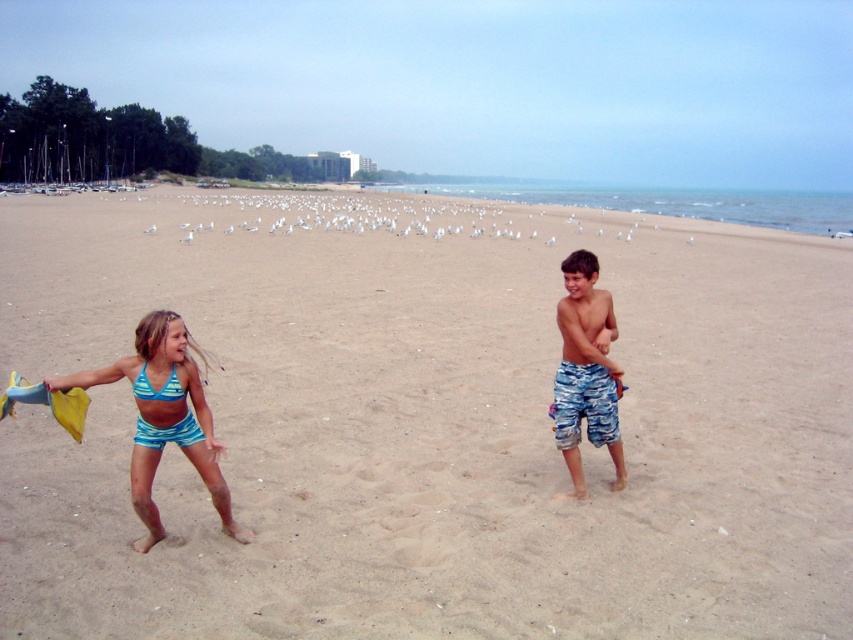
Which is more to the left, beige sandy beach at center or blue fabric bikini top at center-left?

blue fabric bikini top at center-left

Between point (473, 486) and point (152, 397), which one is positioned behind?

Positioned behind is point (473, 486).

Identify the location of beige sandy beach at center. This screenshot has width=853, height=640. (427, 422).

Image resolution: width=853 pixels, height=640 pixels. In order to click on blue striped swimsuit at lower left in this screenshot , I will do `click(165, 419)`.

Is camouflage shorts at right positioned at the back of blue fabric bikini top at center-left?

That is True.

Is point (592, 284) positioned after point (178, 394)?

Yes, point (592, 284) is behind point (178, 394).

This screenshot has height=640, width=853. In order to click on camouflage shorts at right in this screenshot , I will do `click(585, 371)`.